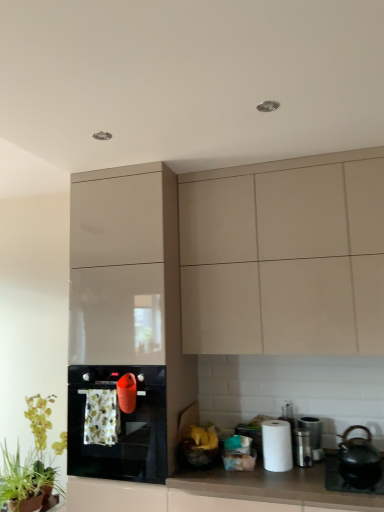
Question: Considering the relative positions of black ceramic sink at lower right and white paper at right in the image provided, is black ceramic sink at lower right to the right of white paper at right from the viewer's perspective?

Choices:
 (A) yes
 (B) no

Answer: (A)

Question: Is black ceramic sink at lower right facing towards white paper at right?

Choices:
 (A) yes
 (B) no

Answer: (B)

Question: Can you confirm if black ceramic sink at lower right is bigger than white paper at right?

Choices:
 (A) no
 (B) yes

Answer: (B)

Question: From the image's perspective, is black ceramic sink at lower right under white paper at right?

Choices:
 (A) yes
 (B) no

Answer: (A)

Question: Does black ceramic sink at lower right have a greater width compared to white paper at right?

Choices:
 (A) yes
 (B) no

Answer: (A)

Question: From a real-world perspective, is black ceramic sink at lower right located higher than white paper at right?

Choices:
 (A) no
 (B) yes

Answer: (A)

Question: Is satin silver canister at lower right, marked as the first appliance in a back-to-front arrangement, turned away from white matte countertop at lower center?

Choices:
 (A) yes
 (B) no

Answer: (B)

Question: From a real-world perspective, is satin silver canister at lower right, arranged as the second appliance when viewed from the front, beneath white matte countertop at lower center?

Choices:
 (A) no
 (B) yes

Answer: (A)

Question: Does satin silver canister at lower right, marked as the first appliance in a back-to-front arrangement, lie in front of white matte countertop at lower center?

Choices:
 (A) no
 (B) yes

Answer: (A)

Question: Could you tell me if satin silver canister at lower right, marked as the first appliance in a back-to-front arrangement, is facing white matte countertop at lower center?

Choices:
 (A) yes
 (B) no

Answer: (B)

Question: Is the surface of satin silver canister at lower right, marked as the first appliance in a back-to-front arrangement, in direct contact with white matte countertop at lower center?

Choices:
 (A) yes
 (B) no

Answer: (B)

Question: Is satin silver canister at lower right, arranged as the second appliance when viewed from the front, taller than white matte countertop at lower center?

Choices:
 (A) yes
 (B) no

Answer: (B)

Question: Does metallic silver trash can at lower right, marked as the 2th appliance in a back-to-front arrangement, have a greater width compared to green leafy plant at lower left, which is the 2th plant in front-to-back order?

Choices:
 (A) yes
 (B) no

Answer: (B)